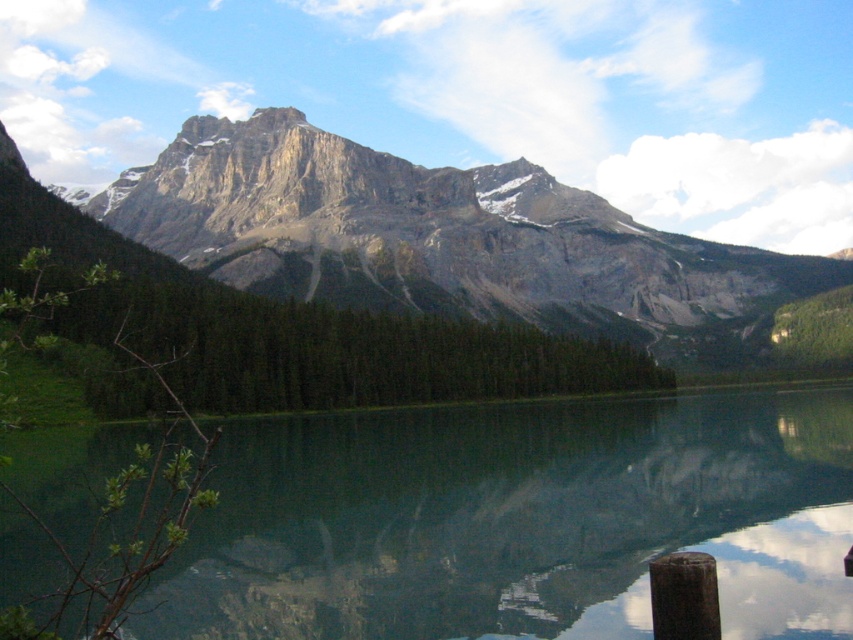
Looking at this image, measure the distance from green glossy water at center to rocky gray mountain range at upper center.

green glossy water at center and rocky gray mountain range at upper center are 166.23 meters apart.

Where is `green glossy water at center`? The image size is (853, 640). green glossy water at center is located at coordinates (518, 518).